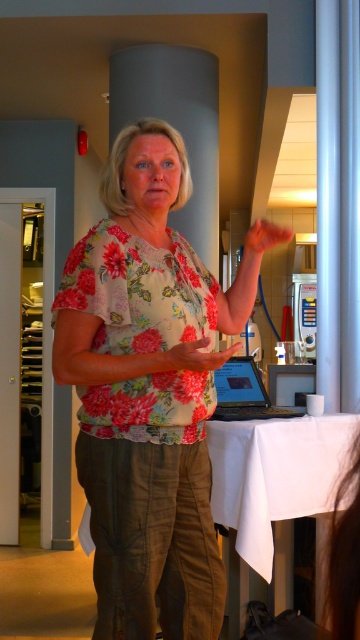
You are a guest at a dinner party and notice the woman holding something in her hand. Where is the white cloth at center located in relation to the woman?

The white cloth at center is located at point (275, 476), which is to the lower right of the woman.